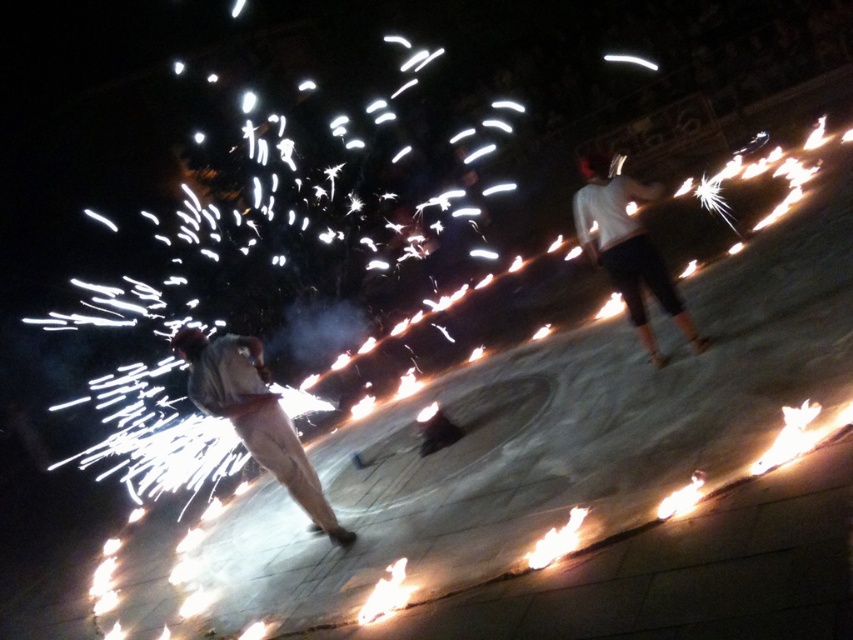
Which is more to the right, light brown fabric pants at center or white matte pants at center?

From the viewer's perspective, white matte pants at center appears more on the right side.

Between light brown fabric pants at center and white matte pants at center, which one has more height?

white matte pants at center

The height and width of the screenshot is (640, 853). In order to click on light brown fabric pants at center in this screenshot , I will do `click(254, 417)`.

Locate an element on the screen. light brown fabric pants at center is located at coordinates (254, 417).